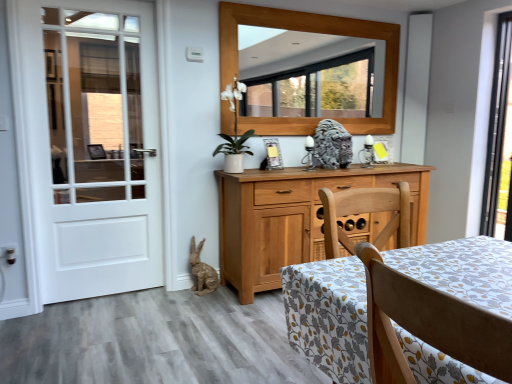
Where is `free space above wooden frame at upper center (from a real-world perspective)`? The width and height of the screenshot is (512, 384). free space above wooden frame at upper center (from a real-world perspective) is located at coordinates (302, 4).